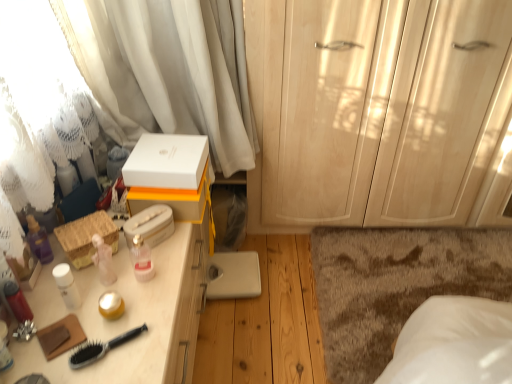
The width and height of the screenshot is (512, 384). What are the coordinates of `vacant space that's between woven straw basket at left, arranged as the first storage box when ordered from the bottom, and black plastic brush at lower left` in the screenshot? It's located at (99, 292).